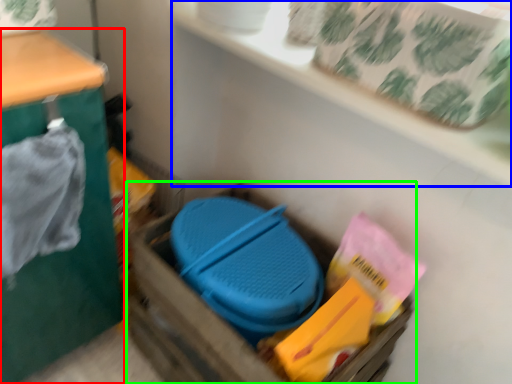
Question: Considering the real-world distances, which object is farthest from furniture (highlighted by a red box)? shelf (highlighted by a blue box) or storage box (highlighted by a green box)?

Choices:
 (A) shelf
 (B) storage box

Answer: (A)